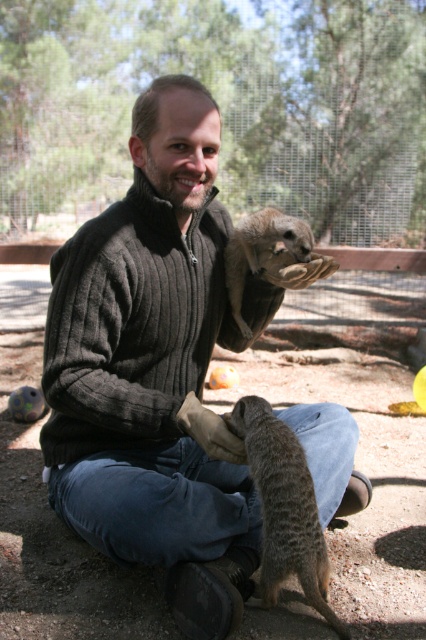
Question: Is grayish-brown fur meerkat at lower center bigger than grayish-brown fur meerkat at upper center?

Choices:
 (A) yes
 (B) no

Answer: (A)

Question: Which of the following is the closest to the observer?

Choices:
 (A) (186, 426)
 (B) (227, 288)
 (C) (284, 449)

Answer: (C)

Question: Which point is closer to the camera?

Choices:
 (A) (239, 284)
 (B) (299, 477)
 (C) (69, 522)

Answer: (B)

Question: Is grayish-brown fur meerkat at lower center below grayish-brown fur meerkat at upper center?

Choices:
 (A) yes
 (B) no

Answer: (A)

Question: Observing the image, what is the correct spatial positioning of dark gray sweater at center in reference to grayish-brown fur meerkat at upper center?

Choices:
 (A) below
 (B) above

Answer: (A)

Question: Considering the real-world distances, which object is farthest from the dark gray sweater at center?

Choices:
 (A) grayish-brown fur meerkat at lower center
 (B) grayish-brown fur meerkat at upper center

Answer: (B)